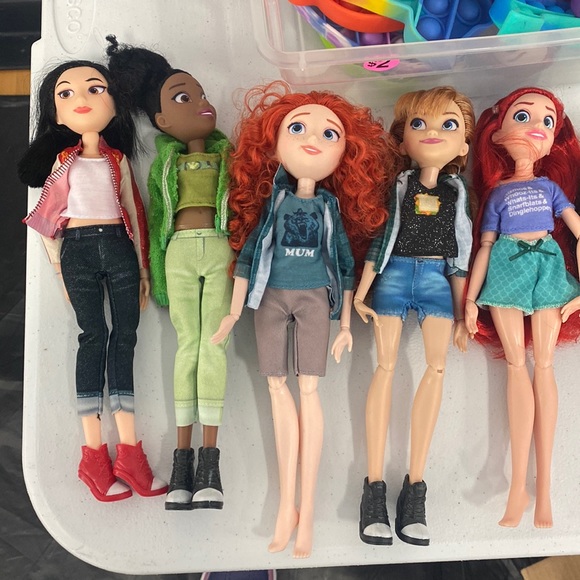
Locate an element on the screen. toy box is located at coordinates (415, 17).